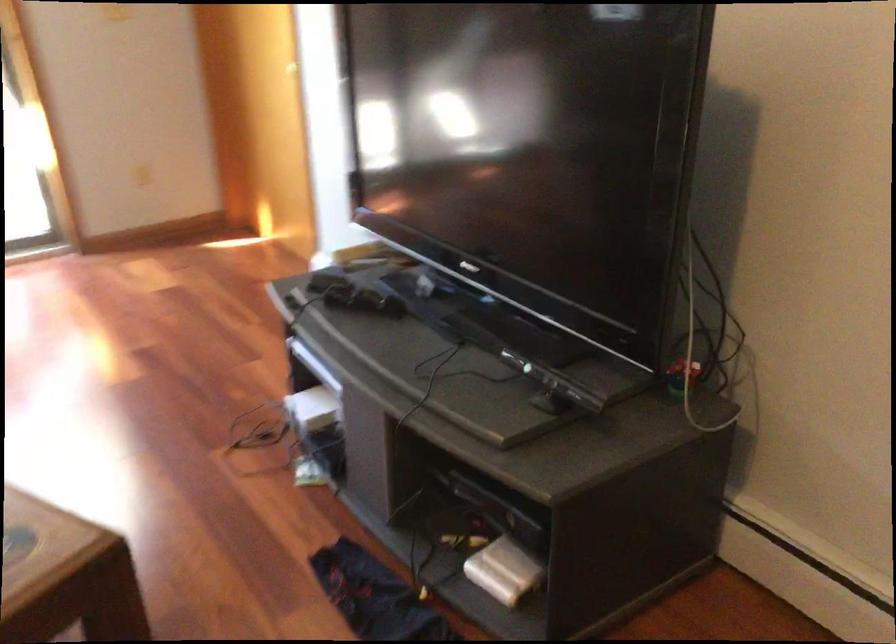
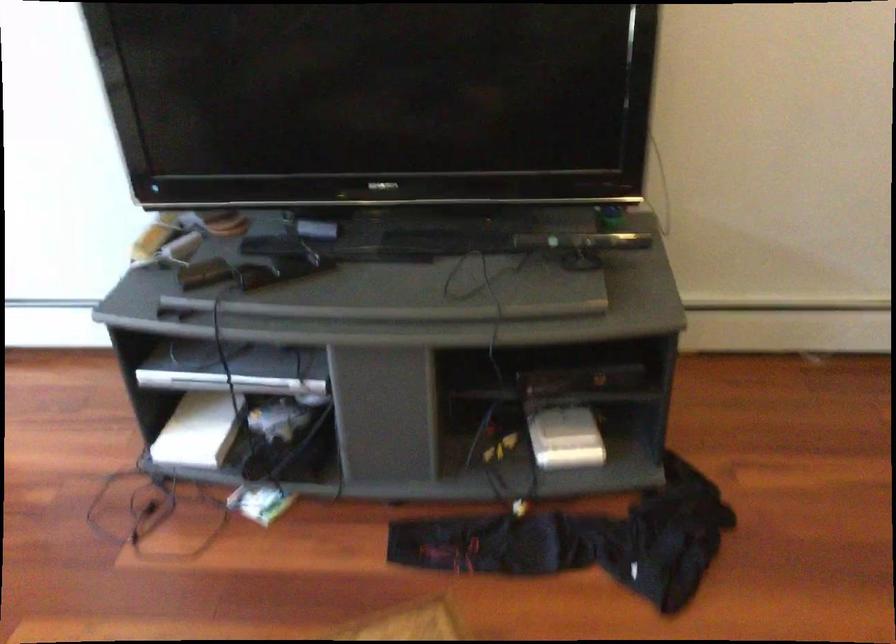
Where in the second image is the point corresponding to [495,565] from the first image?

(565, 438)